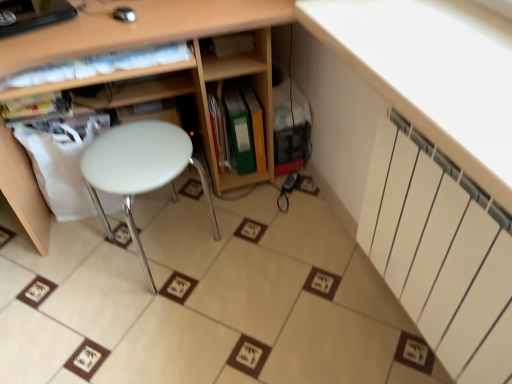
Identify the location of vacant space in front of wooden at center. (184, 321).